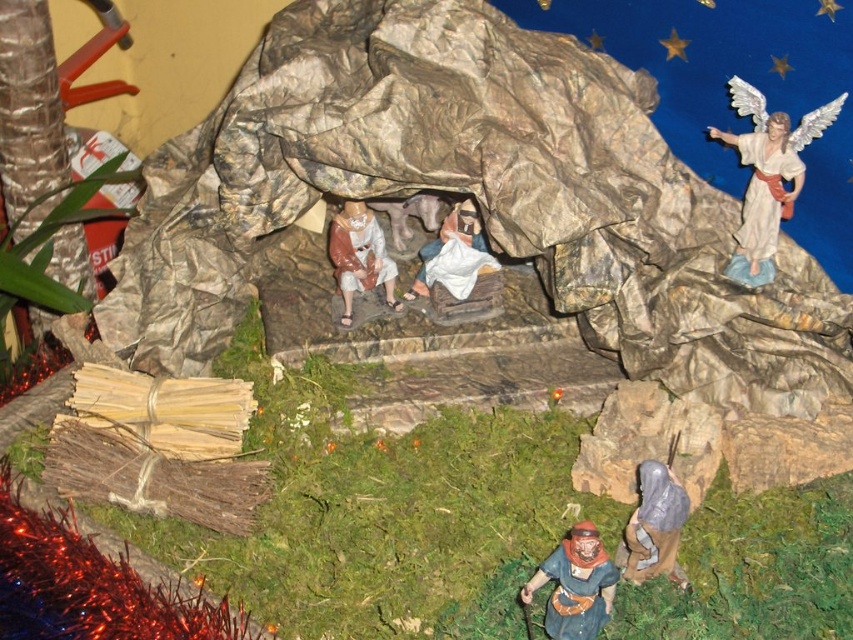
You are setting up a Christmas display and want to place a small candle between the brown painted wood figure at lower center and the smooth beige robe at center. Can you fit the candle if it requires 12 inches of space between them?

The distance between the brown painted wood figure at lower center and the smooth beige robe at center is 18.55 inches, so yes, the candle can be placed between them as there is enough space.

You are setting up a Christmas display and need to place a small gift between the brown painted wood figure at lower center and the smooth beige robe at center. According to the scene description, where should you position the gift?

The gift should be placed between the brown painted wood figure at lower center and the smooth beige robe at center, positioning it to the right of the smooth beige robe at center since the brown painted wood figure at lower center is already to the right of it.